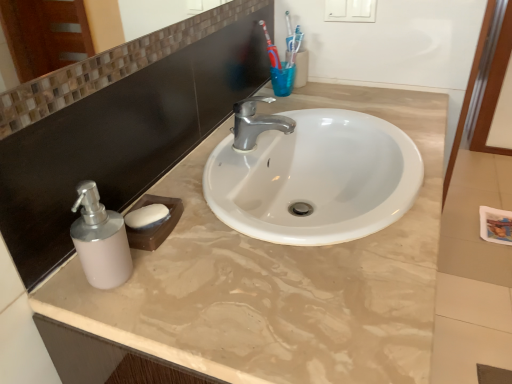
What are the coordinates of `empty space that is ontop of beige marble counter at center` in the screenshot? It's located at (294, 228).